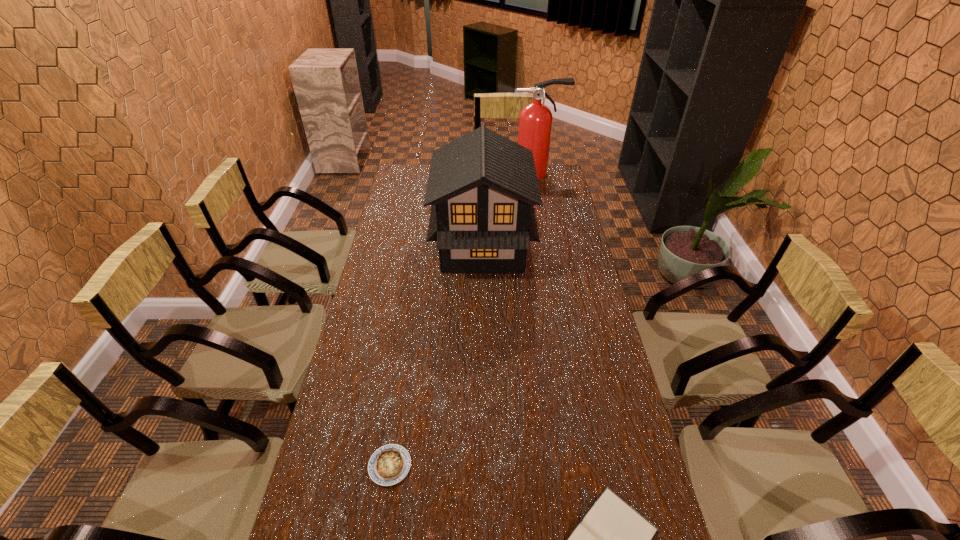
Where is `the farthest object`? This screenshot has height=540, width=960. the farthest object is located at coordinates (535, 120).

The width and height of the screenshot is (960, 540). I want to click on dollhouse, so click(x=482, y=186).

You are a GUI agent. You are given a task and a screenshot of the screen. Output one action in this format:
    pyautogui.click(x=<x>, y=<y>)
    Task: Click on the quiche
    This screenshot has height=540, width=960.
    Given the screenshot: What is the action you would take?
    pyautogui.click(x=389, y=464)

Image resolution: width=960 pixels, height=540 pixels. I want to click on vacant space situated on the left of the fire extinguisher, so click(449, 173).

Find the location of `free point located 0.140m on the front-facing side of the third nearest object`. free point located 0.140m on the front-facing side of the third nearest object is located at coordinates (397, 247).

The width and height of the screenshot is (960, 540). I want to click on free space located 0.150m on the front-facing side of the third nearest object, so click(395, 247).

You are a GUI agent. You are given a task and a screenshot of the screen. Output one action in this format:
    pyautogui.click(x=<x>, y=<y>)
    Task: Click on the vacant space located 0.160m on the front-facing side of the third nearest object
    The width and height of the screenshot is (960, 540).
    Given the screenshot: What is the action you would take?
    pyautogui.click(x=393, y=247)

Where is `vacant space located 0.110m on the front of the quiche`? This screenshot has width=960, height=540. vacant space located 0.110m on the front of the quiche is located at coordinates (379, 537).

Where is `object positioned at the far edge`? This screenshot has height=540, width=960. object positioned at the far edge is located at coordinates (535, 120).

I want to click on object located at the left edge, so click(389, 464).